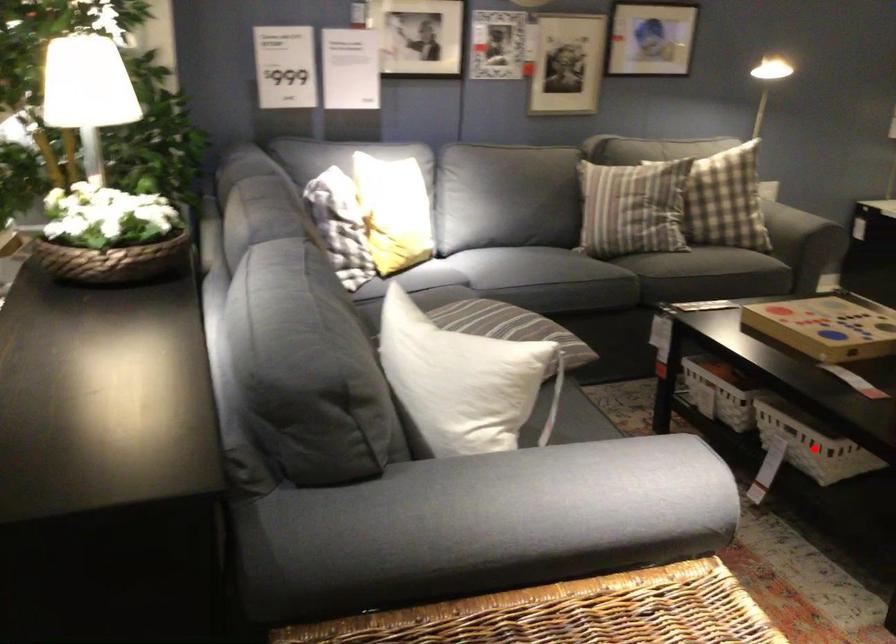
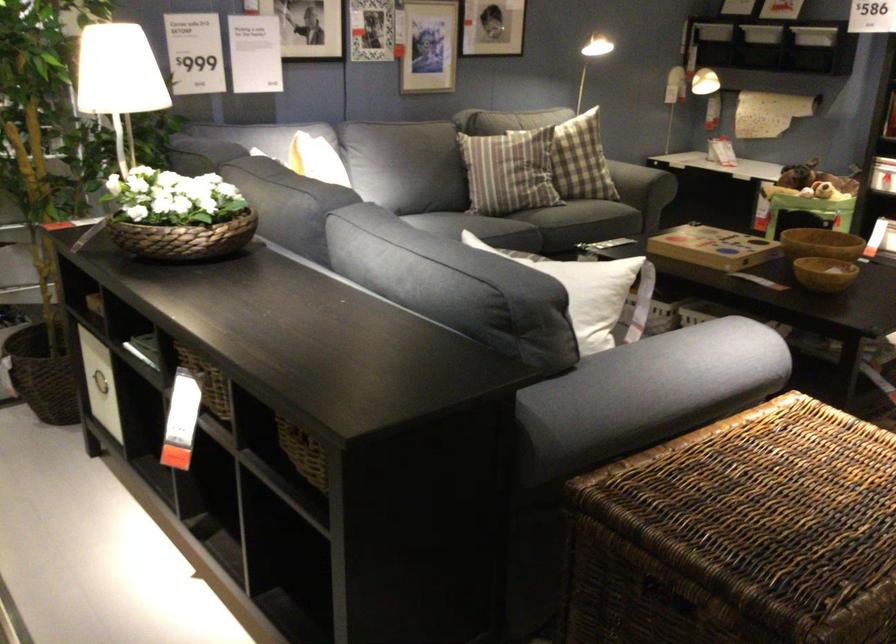
Question: I am providing you with two images of the same scene from different viewpoints. A red point is marked on the first image. Is the red point's position out of view in image 2?

Choices:
 (A) Yes
 (B) No

Answer: (A)